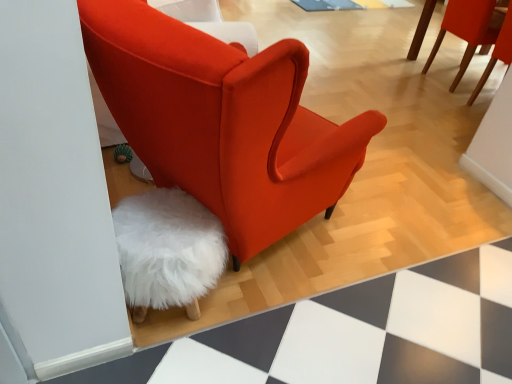
At what (x,y) coordinates should I click in order to perform the action: click on vacant space in front of white fluffy stool at lower left. Please return your answer as a coordinate pair (x, y). This screenshot has width=512, height=384. Looking at the image, I should click on (172, 358).